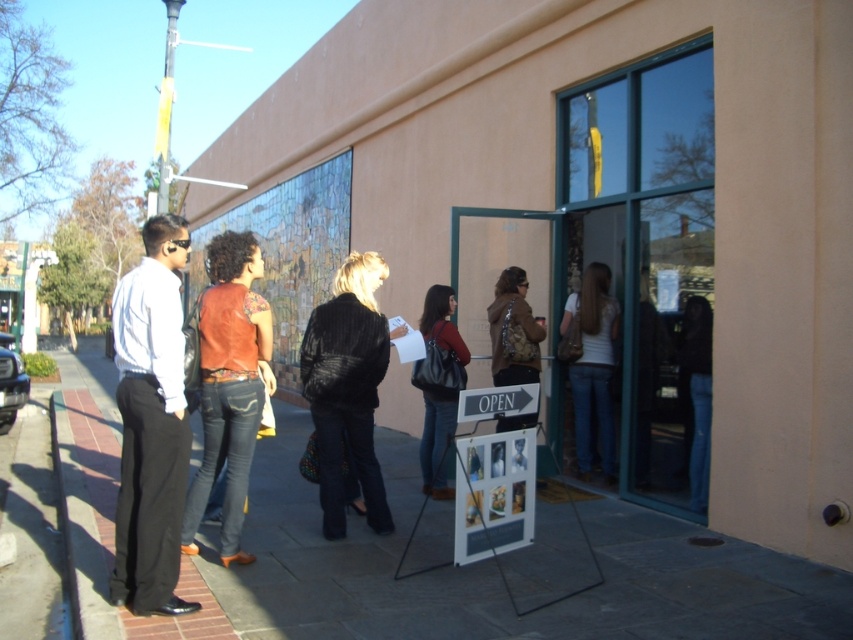
Question: Which object is the closest to the paved stone sidewalk at lower left?

Choices:
 (A) matte black purse at center
 (B) denim jeans at center
 (C) white shirt at left
 (D) velvet black jacket at center

Answer: (A)

Question: Which is nearer to the velvet black jacket at center?

Choices:
 (A) paved stone sidewalk at lower left
 (B) denim jeans at center
 (C) matte black purse at center
 (D) white shirt at left

Answer: (C)

Question: Is paved stone sidewalk at lower left further to the viewer compared to denim jeans at center?

Choices:
 (A) yes
 (B) no

Answer: (B)

Question: Is velvet black jacket at center below jeans at center?

Choices:
 (A) no
 (B) yes

Answer: (A)

Question: Among these objects, which one is farthest from the camera?

Choices:
 (A) jeans at center
 (B) white shirt at left
 (C) velvet black jacket at center
 (D) matte black purse at center

Answer: (D)

Question: Observing the image, what is the correct spatial positioning of leather jacket at center in reference to jeans at center?

Choices:
 (A) below
 (B) above

Answer: (B)